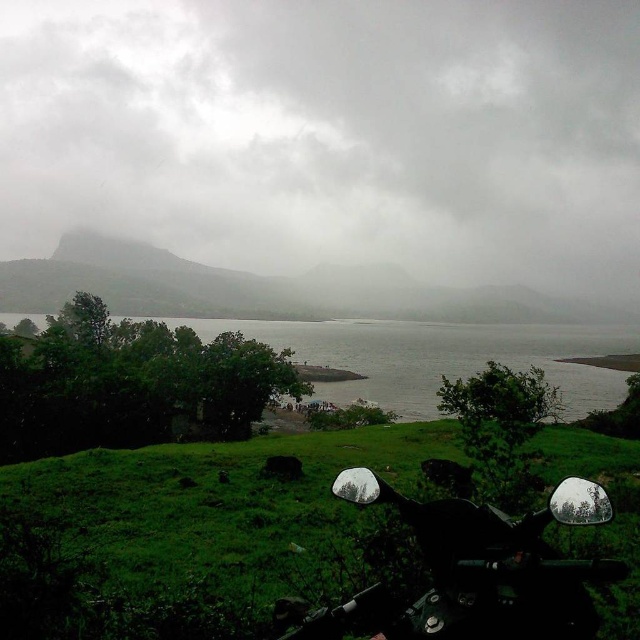
Question: Can you confirm if green matte mountain at upper left is positioned above green grassy water at lower center?

Choices:
 (A) no
 (B) yes

Answer: (B)

Question: Which of these objects is positioned closest to the cloudy fog at upper center?

Choices:
 (A) glossy black motorcycle at lower center
 (B) green grassy water at lower center
 (C) green matte mountain at upper left

Answer: (C)

Question: Can you confirm if cloudy fog at upper center is positioned above glossy black motorcycle at lower center?

Choices:
 (A) yes
 (B) no

Answer: (A)

Question: Which point is closer to the camera?

Choices:
 (A) coord(605,540)
 (B) coord(35,90)

Answer: (A)

Question: Is green grassy at lower center above green grassy water at lower center?

Choices:
 (A) yes
 (B) no

Answer: (B)

Question: Which point is closer to the camera taking this photo?

Choices:
 (A) (500, 632)
 (B) (141, 257)

Answer: (A)